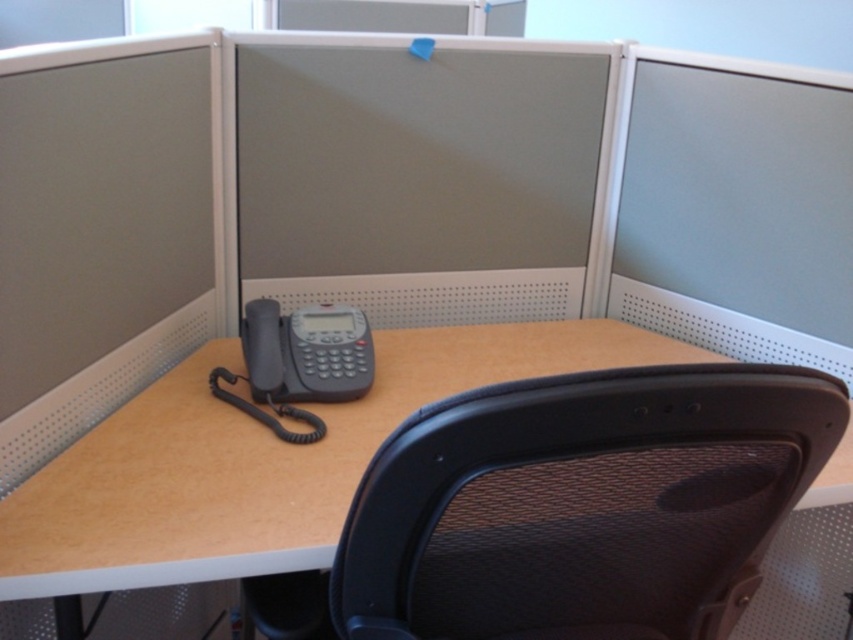
You are setting up a new desk arrangement and need to place both the matte black telephone at center and the matte gray monitor at upper right on the desk. Based on their sizes, which object should you place closer to the edge of the desk to ensure stability?

The matte black telephone at center is shorter than the matte gray monitor at upper right, so you should place the matte black telephone at center closer to the edge of the desk since shorter objects are generally more stable when placed nearer to the edge.

You are an office worker who needs to place both the matte black telephone at center and the matte gray monitor at upper right into a storage box. The box can only fit items that are smaller than the monitor. Which item cannot be placed in the box?

The matte black telephone at center cannot be placed in the box because it is bigger than the matte gray monitor at upper right, which is the size limit for the box.

You are an office worker sitting at the desk and need to reach the matte gray monitor at center. Based on the coordinates provided, is the monitor positioned closer to the edge of the desk or closer to the back of the desk?

The matte gray monitor at center is positioned closer to the edge of the desk since its coordinates are at point (421,177), which places it near the front of the desk.